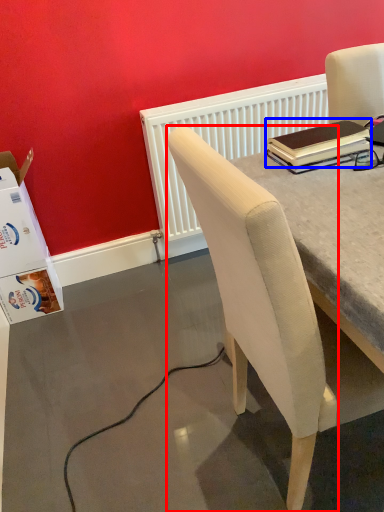
Question: Which point is further to the camera, chair (highlighted by a red box) or notebook (highlighted by a blue box)?

Choices:
 (A) chair
 (B) notebook

Answer: (B)